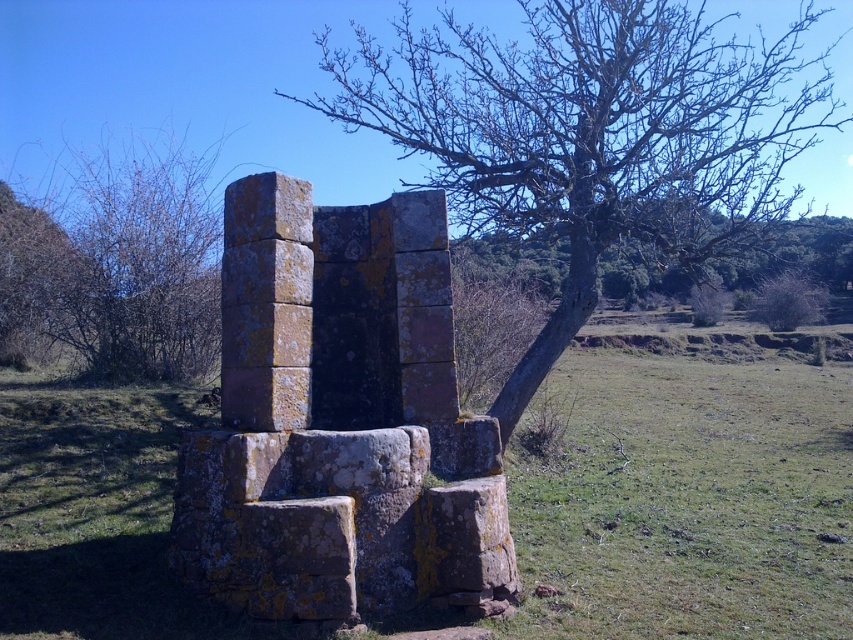
You are standing in front of the stone structure and notice two elements in the scene. The first is the smooth bark tree at center, and the second is the bare branches at upper center. From your vantage point, which of these two objects is positioned to the left of the other?

The smooth bark tree at center is to the left of the bare branches at upper center.

You are an archaeologist examining the ancient stone structure. You notice two elements nearby. The smooth bark tree at center and the bare branches at upper center. Which of these two has a greater width?

The smooth bark tree at center has a greater width than the bare branches at upper center.